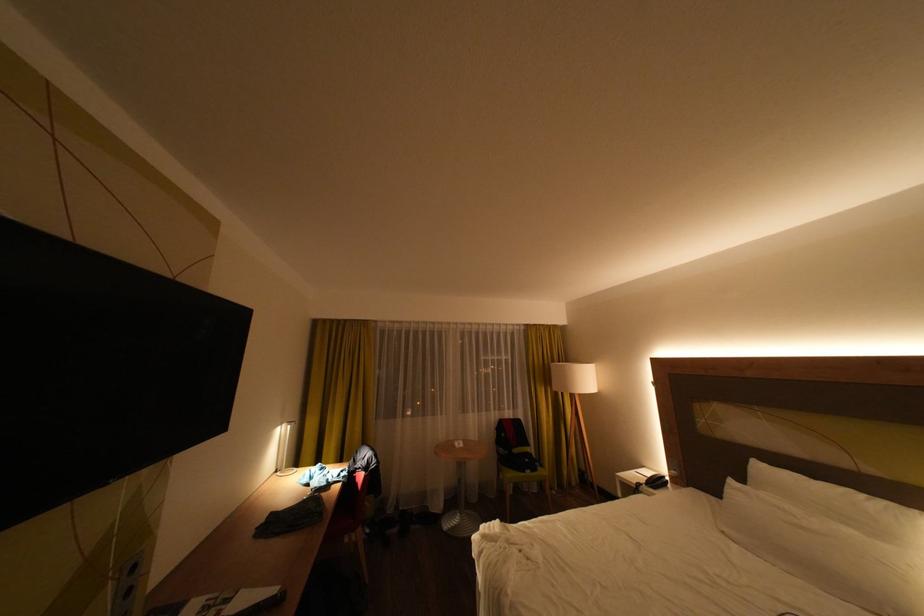
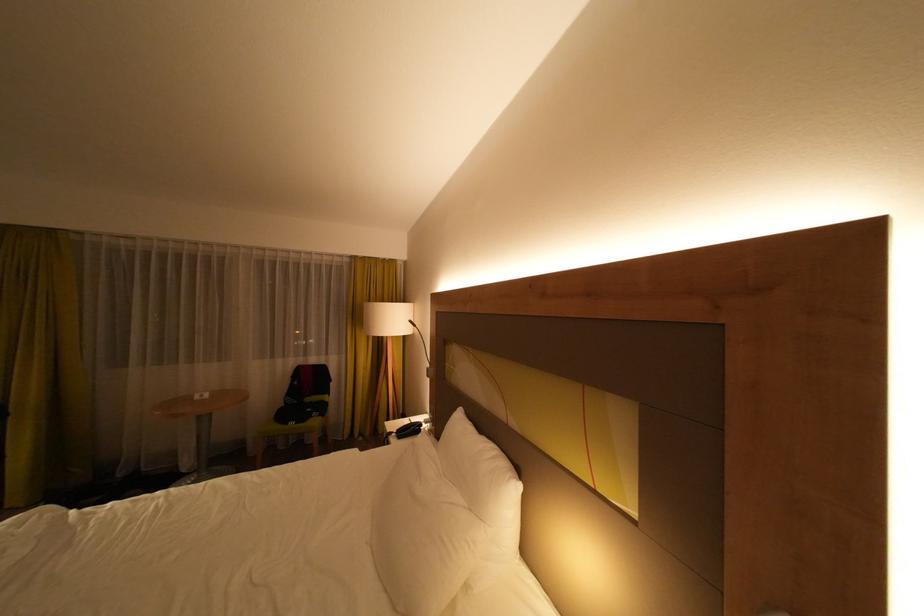
Question: Which direction would the cameraman need to move to produce the second image? Reply with the corresponding letter.

Choices:
 (A) Left
 (B) Right
 (C) Forward
 (D) Backward

Answer: (B)